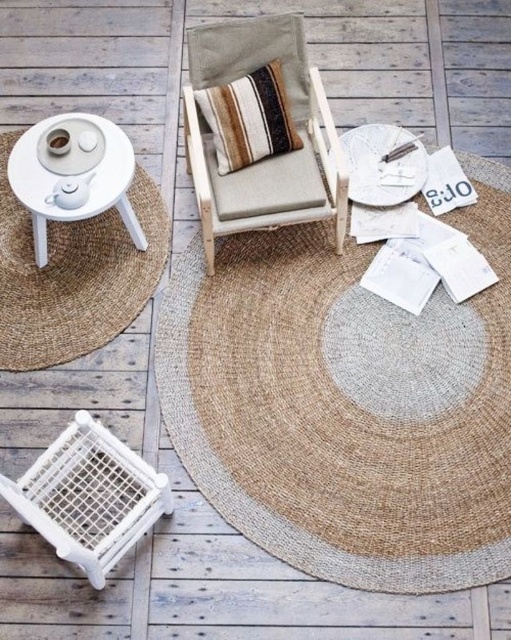
From the picture: You are arranging a small outdoor gathering and need to place a decorative vase on the table. Given the layout of the natural jute mat at center and the white matte table at upper left, where should you position the vase to ensure it is visible from the main entrance which faces the center of the scene?

The natural jute mat at center is to the right of the white matte table at upper left. To ensure visibility from the main entrance facing the center, place the vase on the right side of the white matte table at upper left so it aligns with the natural jute mat at center.

You are planning to place a 24 inch wide decorative item between the natural jute mat at center and the white matte table at upper left. Will there be enough space for it?

The distance between the natural jute mat at center and the white matte table at upper left is 25.00 inches. Since the decorative item is 24 inches wide, there is enough space to place it between them.